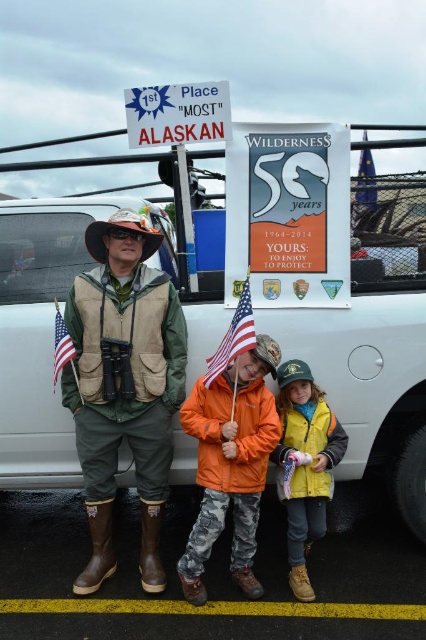
Question: Estimate the real-world distances between objects in this image. Which object is closer to the yellow matte vest at lower center?

Choices:
 (A) white matte truck at center
 (B) blue fabric flag at upper right
 (C) camouflage fabric vest at left
 (D) american flag at center

Answer: (A)

Question: Is american flag at center further to the viewer compared to blue fabric flag at upper right?

Choices:
 (A) yes
 (B) no

Answer: (B)

Question: Does orange fleece jacket at center appear on the left side of american flag at center?

Choices:
 (A) no
 (B) yes

Answer: (B)

Question: Considering the real-world distances, which object is closest to the white matte truck at center?

Choices:
 (A) yellow matte vest at lower center
 (B) orange fleece jacket at center
 (C) camouflage fabric vest at left

Answer: (A)

Question: Which of the following is the farthest from the observer?

Choices:
 (A) (313, 445)
 (B) (405, 340)
 (C) (54, 346)
 (D) (253, 388)

Answer: (C)

Question: Can you confirm if camouflage fabric vest at left is positioned to the left of orange fleece jacket at center?

Choices:
 (A) yes
 (B) no

Answer: (A)